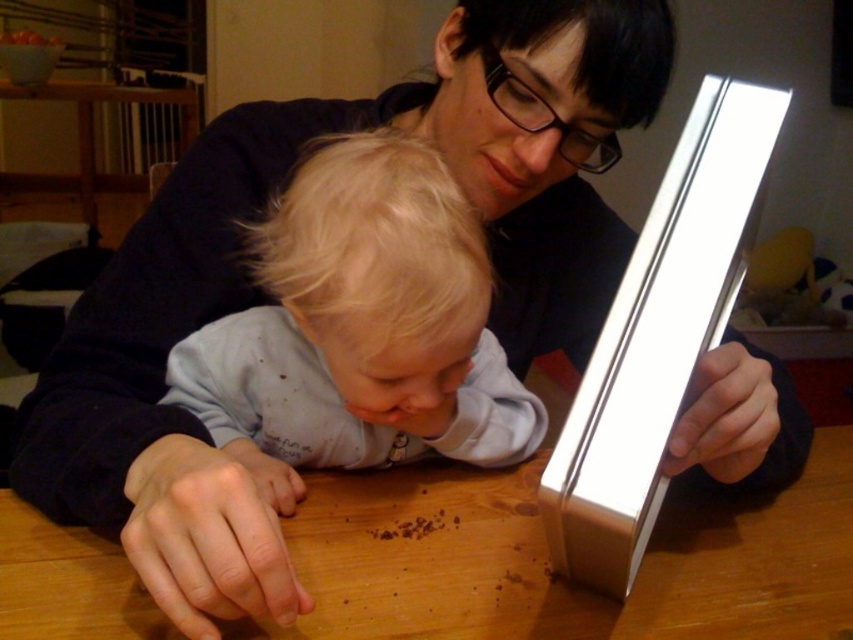
Question: Is wooden table at center further to camera compared to light blue cotton shirt at center?

Choices:
 (A) no
 (B) yes

Answer: (B)

Question: Is wooden table at center above light blue cotton shirt at center?

Choices:
 (A) yes
 (B) no

Answer: (B)

Question: Is wooden table at center closer to camera compared to light blue cotton shirt at center?

Choices:
 (A) yes
 (B) no

Answer: (B)

Question: Which object appears closest to the camera in this image?

Choices:
 (A) wooden table at center
 (B) light blue cotton shirt at center

Answer: (B)